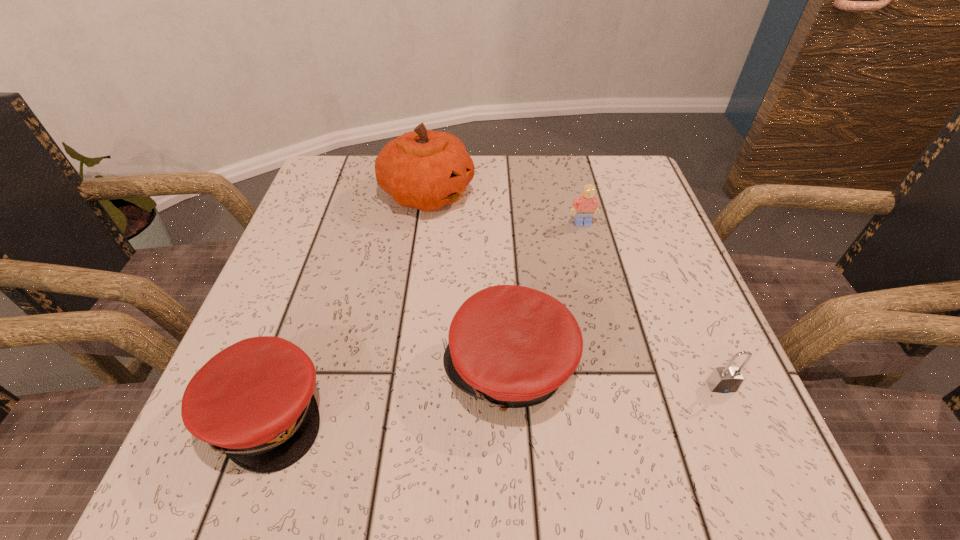
The height and width of the screenshot is (540, 960). I want to click on the tallest object, so click(x=423, y=169).

What are the coordinates of `the fourth object from left to right` in the screenshot? It's located at (586, 205).

You are a GUI agent. You are given a task and a screenshot of the screen. Output one action in this format:
    pyautogui.click(x=<x>, y=<y>)
    Task: Click on the right cap
    
    Given the screenshot: What is the action you would take?
    click(x=512, y=346)

You are a GUI agent. You are given a task and a screenshot of the screen. Output one action in this format:
    pyautogui.click(x=<x>, y=<y>)
    Task: Click on the padlock
    The height and width of the screenshot is (540, 960).
    Given the screenshot: What is the action you would take?
    pos(727,379)

The image size is (960, 540). Identify the location of the left cap. (254, 400).

Identify the location of vacant space located on the front-facing side of the tallest object. (505, 194).

In order to click on free spot located 0.280m on the front-facing side of the Lego in this screenshot , I will do `click(610, 333)`.

This screenshot has height=540, width=960. I want to click on vacant space located on the front of the right cap with an emblem, so click(x=280, y=368).

The width and height of the screenshot is (960, 540). Identify the location of vacant space located 0.150m on the front of the right cap with an emblem. (348, 368).

Identify the location of vacant space situated 0.260m on the front of the right cap with an emblem. (280, 368).